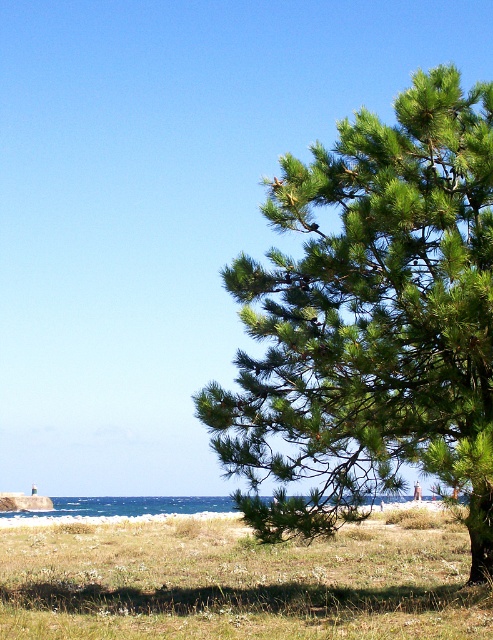
Question: Is green needle-like at right below green grassy at lower center?

Choices:
 (A) no
 (B) yes

Answer: (A)

Question: Is green needle-like at right smaller than green grassy at lower center?

Choices:
 (A) yes
 (B) no

Answer: (A)

Question: From the image, what is the correct spatial relationship of green needle-like at right in relation to green grassy at lower center?

Choices:
 (A) below
 (B) above

Answer: (B)

Question: Among these points, which one is farthest from the camera?

Choices:
 (A) (364, 179)
 (B) (244, 557)

Answer: (B)

Question: Which point appears closest to the camera in this image?

Choices:
 (A) (464, 579)
 (B) (415, 435)

Answer: (B)